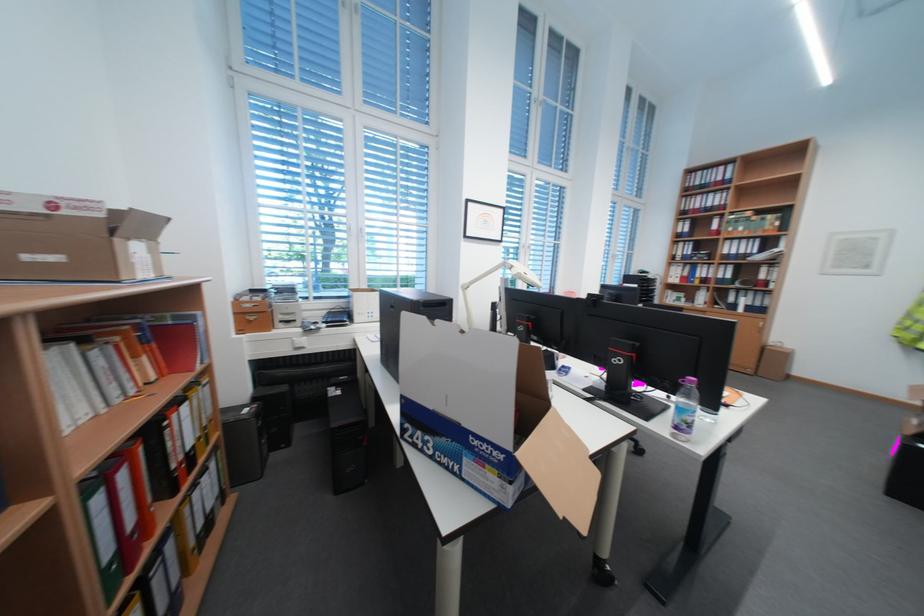
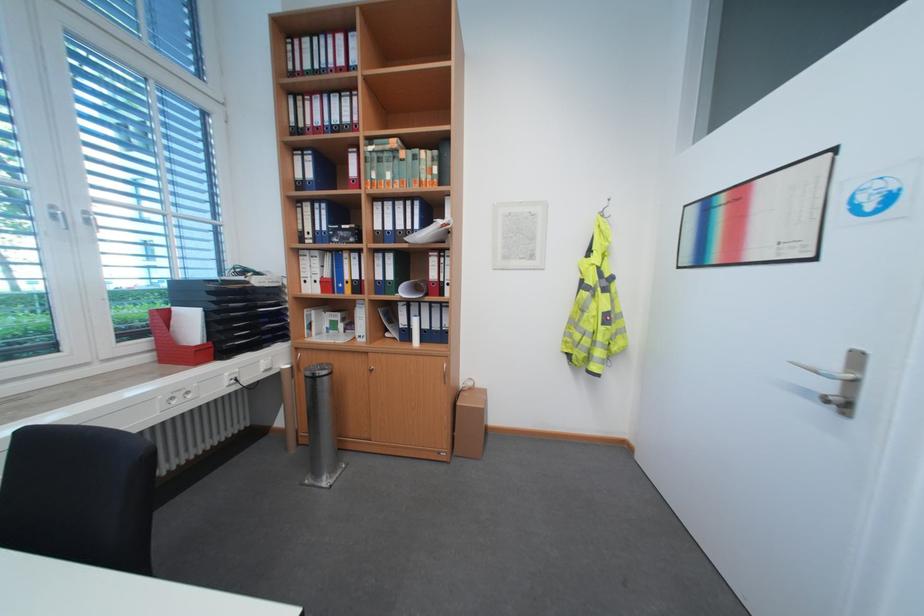
In the second image, find the point that corresponds to point 766,253 in the first image.

(428, 227)